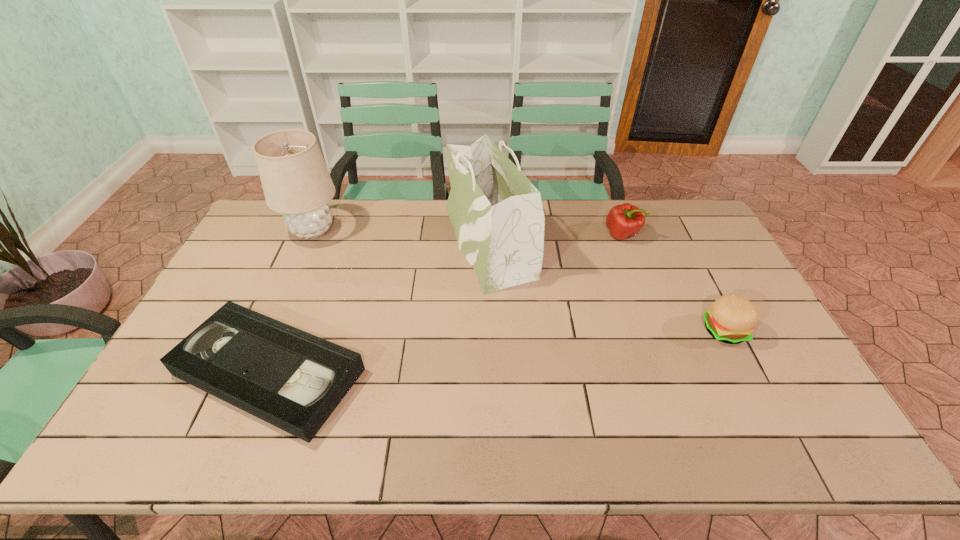
At what (x,y) coordinates should I click in order to perform the action: click on the third object from left to right. Please return your answer as a coordinate pair (x, y). The width and height of the screenshot is (960, 540). Looking at the image, I should click on (504, 242).

The height and width of the screenshot is (540, 960). What are the coordinates of `lampshade` in the screenshot? It's located at (296, 182).

Where is `bell pepper`? This screenshot has height=540, width=960. bell pepper is located at coordinates (624, 221).

Where is `hamburger`? This screenshot has width=960, height=540. hamburger is located at coordinates (731, 319).

The image size is (960, 540). In order to click on the shortest object in this screenshot , I will do `click(289, 378)`.

Locate an element on the screen. free space located 0.390m on the right of the grocery bag is located at coordinates (648, 241).

Identify the location of free region located 0.170m on the right of the lampshade. This screenshot has width=960, height=540. (392, 231).

Find the location of `free region located on the left of the fourth object from left to right`. free region located on the left of the fourth object from left to right is located at coordinates (550, 234).

Identify the location of free spot located on the front of the hamburger. (774, 428).

Find the location of a particular element. The height and width of the screenshot is (540, 960). blank space located on the right of the videotape is located at coordinates (481, 372).